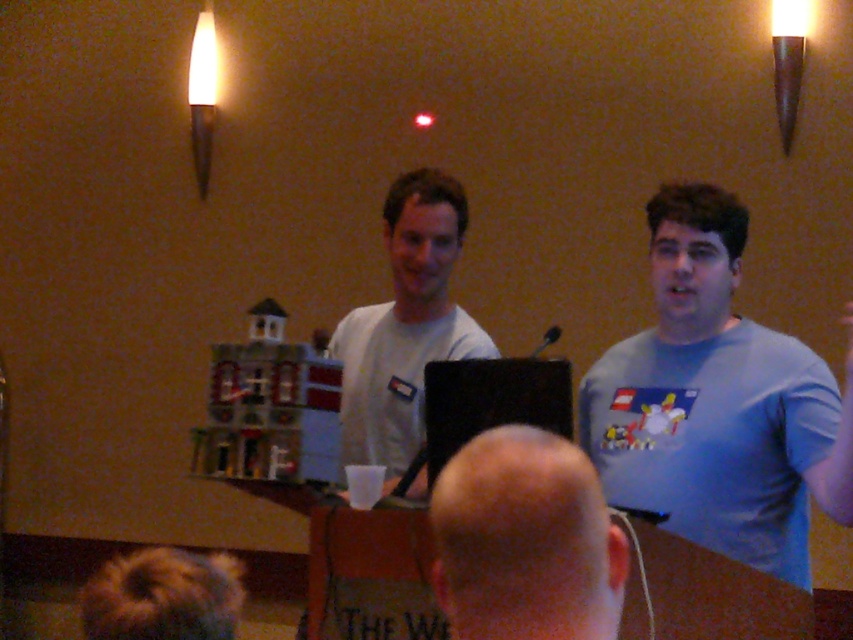
Is bald head at center below white matte t-shirt at center?

Yes.

Can you confirm if bald head at center is positioned above white matte t-shirt at center?

No.

This screenshot has height=640, width=853. I want to click on bald head at center, so click(x=525, y=541).

Is blue cotton shirt at center thinner than white matte t-shirt at center?

No, blue cotton shirt at center is not thinner than white matte t-shirt at center.

Is point (691, 464) more distant than point (387, 369)?

No, (691, 464) is closer to viewer.

Is point (643, 346) positioned behind point (355, 369)?

No, (643, 346) is closer to viewer.

Find the location of a particular element. This screenshot has height=640, width=853. blue cotton shirt at center is located at coordinates [x=717, y=403].

Is blue cotton shirt at center above bald head at center?

Yes.

Find the location of `blue cotton shirt at center`. blue cotton shirt at center is located at coordinates (717, 403).

At what (x,y) coordinates should I click in order to perform the action: click on blue cotton shirt at center. Please return your answer as a coordinate pair (x, y). This screenshot has height=640, width=853. Looking at the image, I should click on (717, 403).